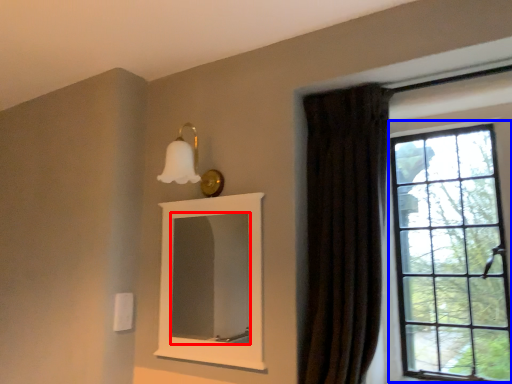
Question: Which object appears closest to the camera in this image, mirror (highlighted by a red box) or window (highlighted by a blue box)?

Choices:
 (A) mirror
 (B) window

Answer: (B)